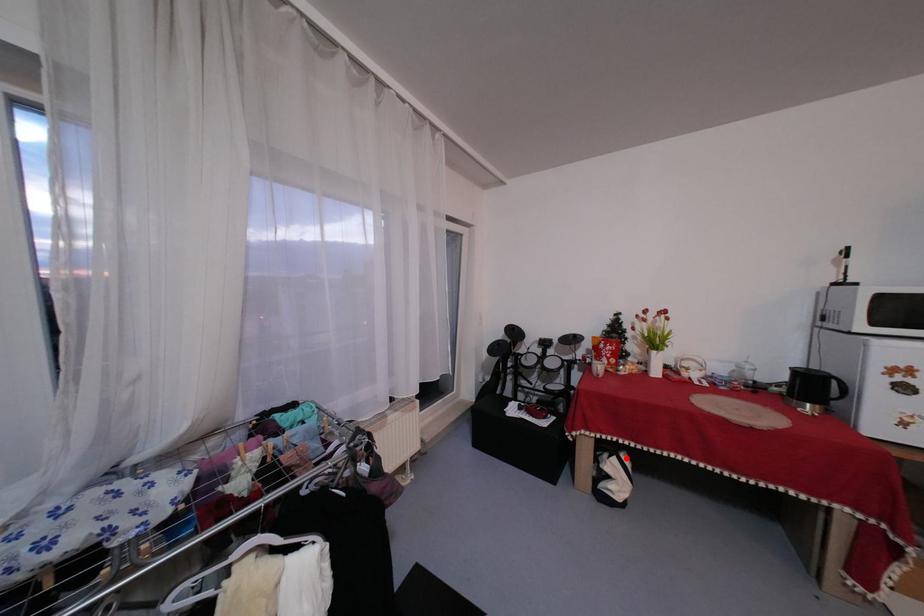
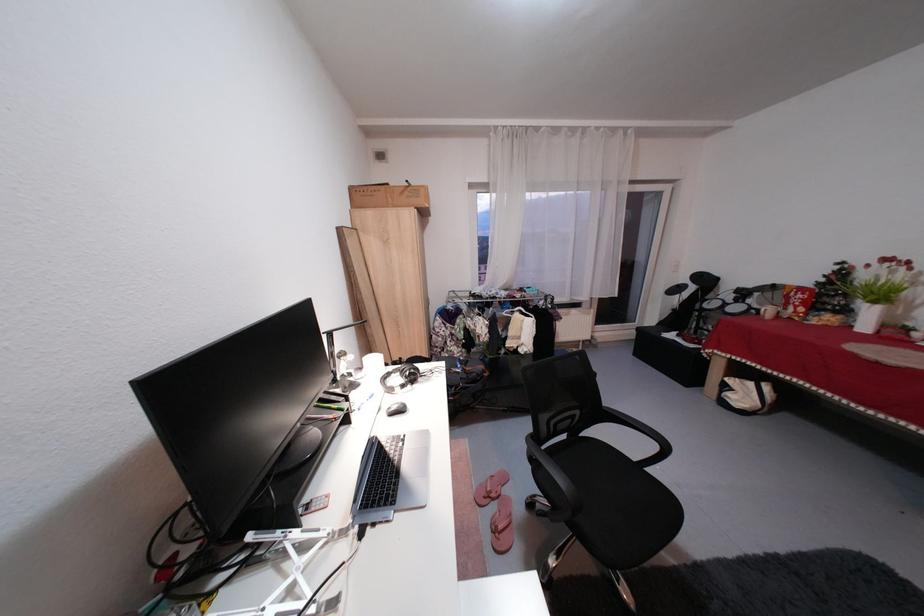
Locate, in the second image, the point that corresponds to the highlighted location in the first image.

(764, 384)